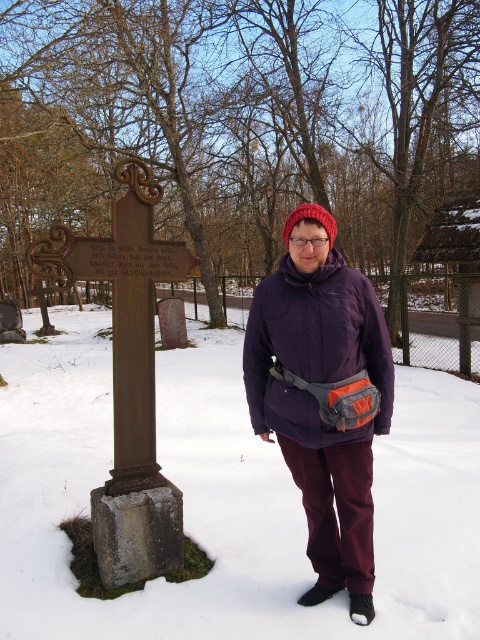
Question: Does purple fleece jacket at center have a smaller size compared to bronze stone cross at left?

Choices:
 (A) no
 (B) yes

Answer: (B)

Question: Is purple fleece jacket at center behind bronze stone cross at left?

Choices:
 (A) yes
 (B) no

Answer: (B)

Question: Which point is closer to the camera?

Choices:
 (A) (266, 342)
 (B) (148, 234)

Answer: (A)

Question: Which point is farther from the camera taking this photo?

Choices:
 (A) (48, 253)
 (B) (279, 422)

Answer: (A)

Question: Can you confirm if purple fleece jacket at center is smaller than bronze stone cross at left?

Choices:
 (A) yes
 (B) no

Answer: (A)

Question: Which point is farther to the camera?

Choices:
 (A) (136, 289)
 (B) (333, 291)

Answer: (A)